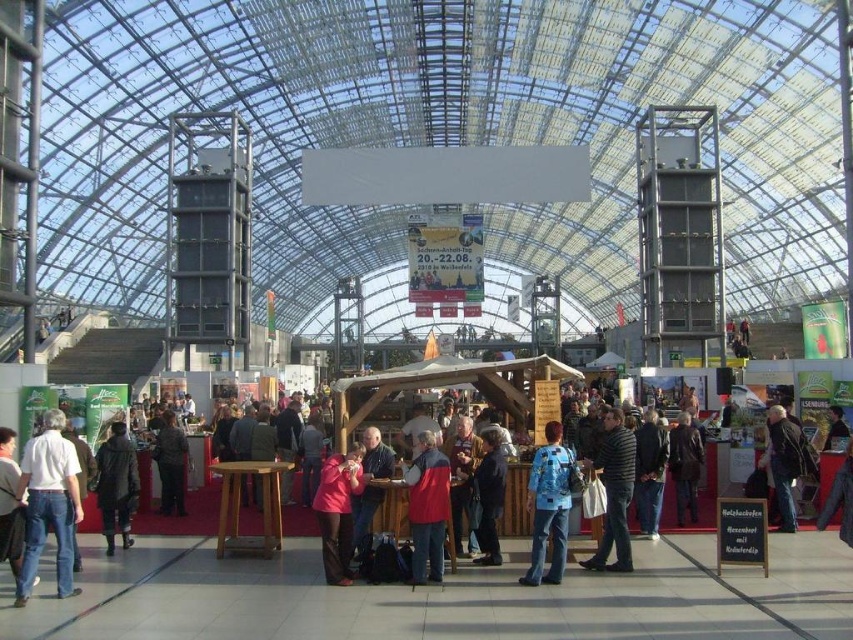
Is point (502, 477) closer to camera compared to point (646, 490)?

That is True.

Can you confirm if dark blue fabric jacket at center is smaller than dark gray sweater at center?

Correct, dark blue fabric jacket at center occupies less space than dark gray sweater at center.

Locate an element on the screen. This screenshot has width=853, height=640. dark blue fabric jacket at center is located at coordinates (489, 496).

Can you confirm if white cotton shirt at lower left is positioned to the right of red fleece vest at center?

No, white cotton shirt at lower left is not to the right of red fleece vest at center.

In the scene shown: Is white cotton shirt at lower left bigger than red fleece vest at center?

Indeed, white cotton shirt at lower left has a larger size compared to red fleece vest at center.

In order to click on white cotton shirt at lower left in this screenshot , I will do `click(48, 504)`.

Find the location of `white cotton shirt at lower left`. white cotton shirt at lower left is located at coordinates (48, 504).

Does red fleece vest at center appear over dark blue shirt at center?

No.

Measure the distance between point (x=440, y=529) and camera.

Point (x=440, y=529) is 58.60 meters away from camera.

Between point (425, 486) and point (367, 488), which one is positioned in front?

Point (425, 486)

The height and width of the screenshot is (640, 853). In order to click on red fleece vest at center in this screenshot , I will do `click(427, 508)`.